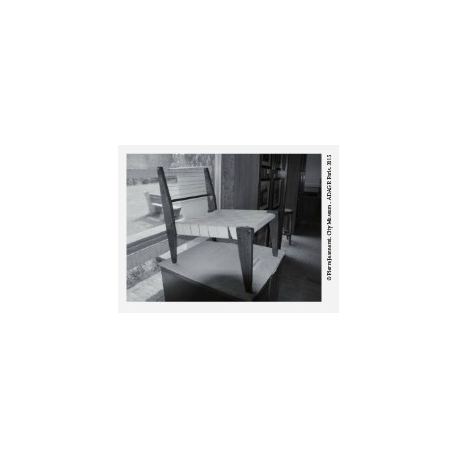
Find the location of a particular element. wall is located at coordinates (315, 181).